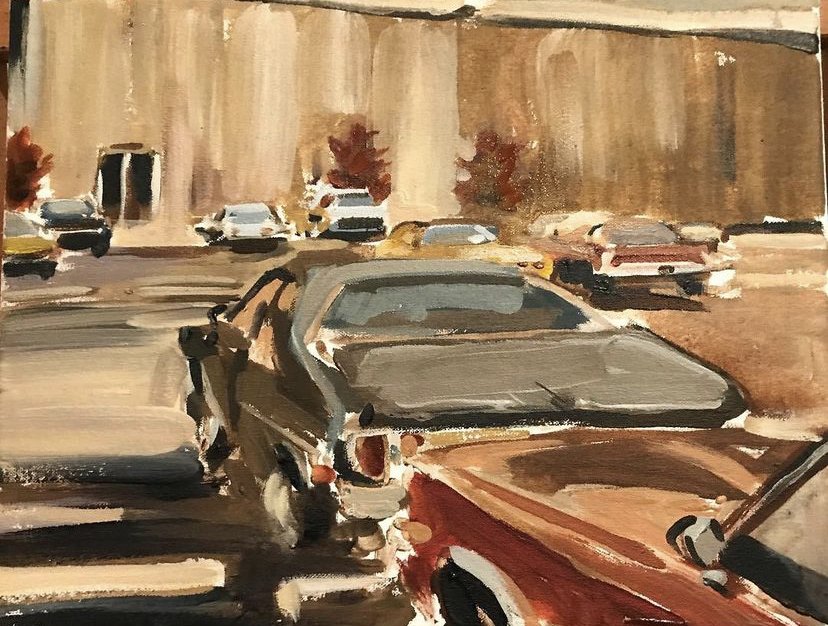
The image size is (828, 626). In order to click on window in this screenshot , I will do `click(121, 168)`.